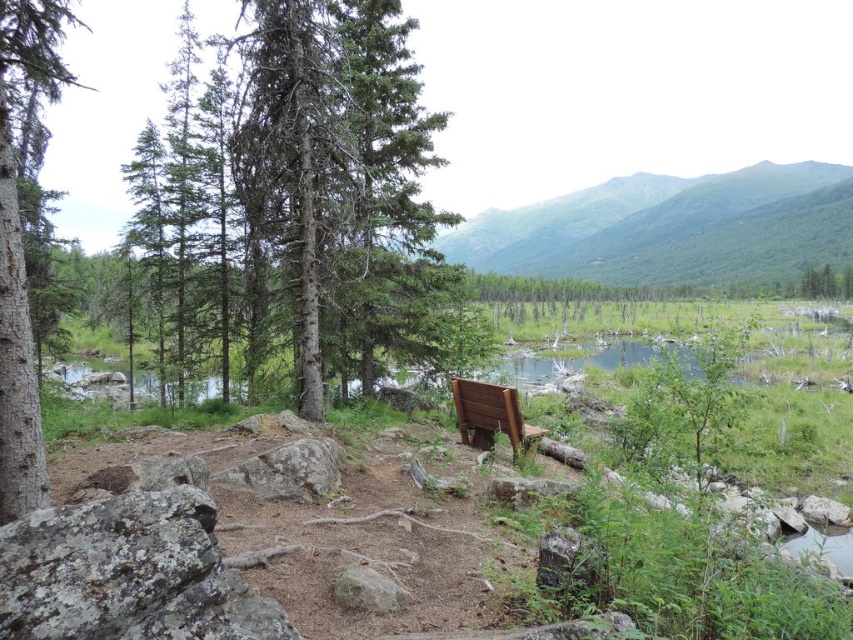
Based on the photo, you are sitting on the wooden bench at center and want to look at the green textured tree at center. In which direction should you turn your head?

The green textured tree at center is to the left of the wooden bench at center, so you should turn your head to the left to look at it.

You are standing at the wooden bench in the scene and want to walk towards the green forested mountain at upper center. Which direction should you head relative to the green matte tree at left?

To reach the green forested mountain at upper center, you should head to the right of the green matte tree at left since the mountain is positioned to the right of the tree.